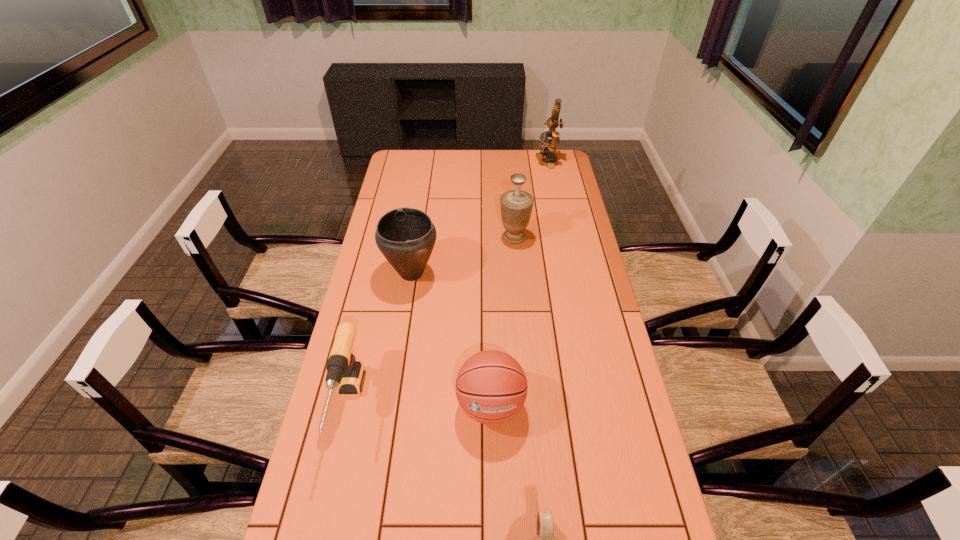
Where is `vacant area that lies between the drill and the farthest object`? vacant area that lies between the drill and the farthest object is located at coordinates (448, 284).

At what (x,y) coordinates should I click in order to perform the action: click on object identified as the closest to the farthest urn. Please return your answer as a coordinate pair (x, y). This screenshot has width=960, height=540. Looking at the image, I should click on (405, 236).

Point out which object is positioned as the nearest to the drill. Please provide its 2D coordinates. Your answer should be formatted as a tuple, i.e. [(x, y)], where the tuple contains the x and y coordinates of a point satisfying the conditions above.

[(405, 236)]

Find the location of `urn that is the second closest one to the basketball`. urn that is the second closest one to the basketball is located at coordinates (405, 236).

Select which urn appears as the closest to the basketball. Please provide its 2D coordinates. Your answer should be formatted as a tuple, i.e. [(x, y)], where the tuple contains the x and y coordinates of a point satisfying the conditions above.

[(544, 539)]

Image resolution: width=960 pixels, height=540 pixels. I want to click on vacant region that satisfies the following two spatial constraints: 1. on the back side of the farthest urn; 2. on the left side of the tallest object, so click(x=508, y=163).